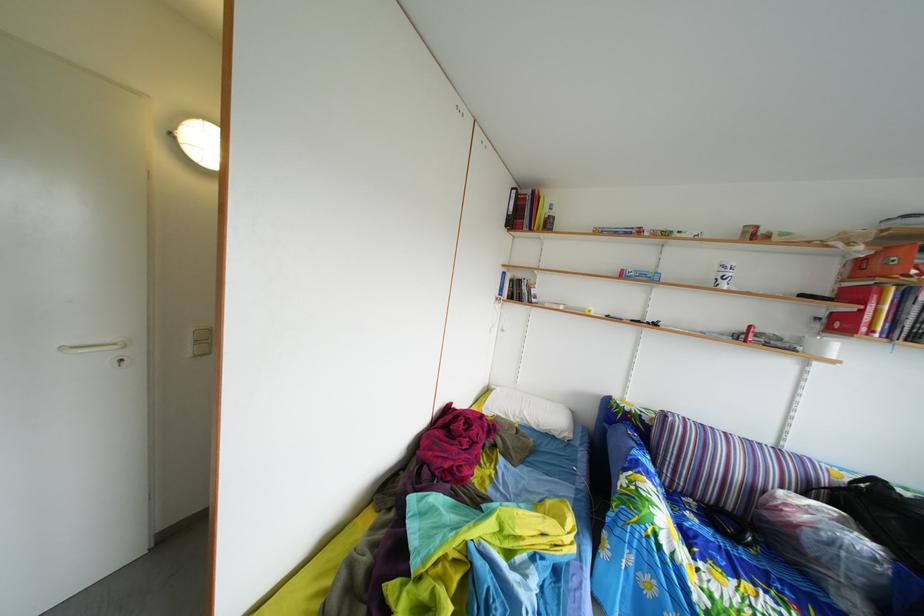
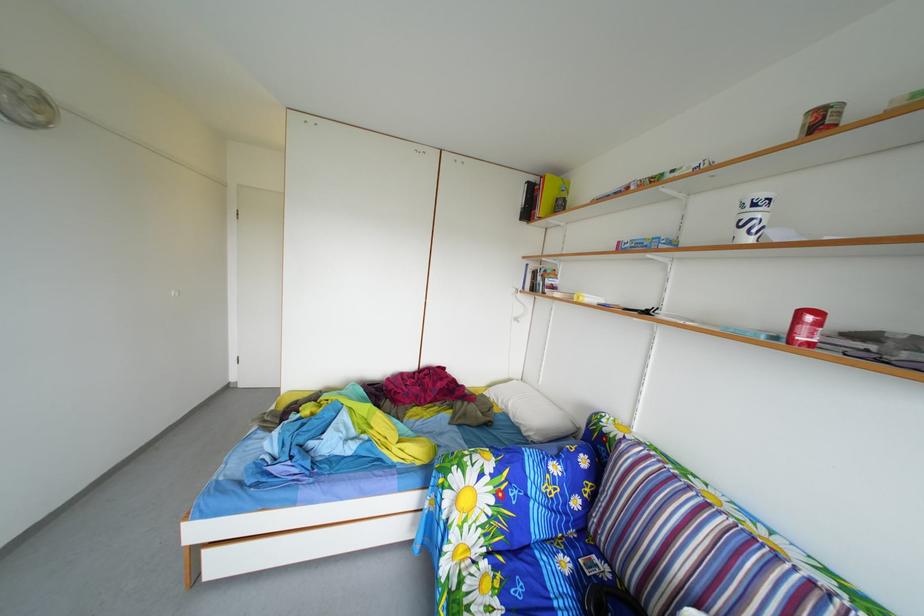
Locate, in the second image, the point that corresponds to point 760,334 in the first image.

(811, 321)